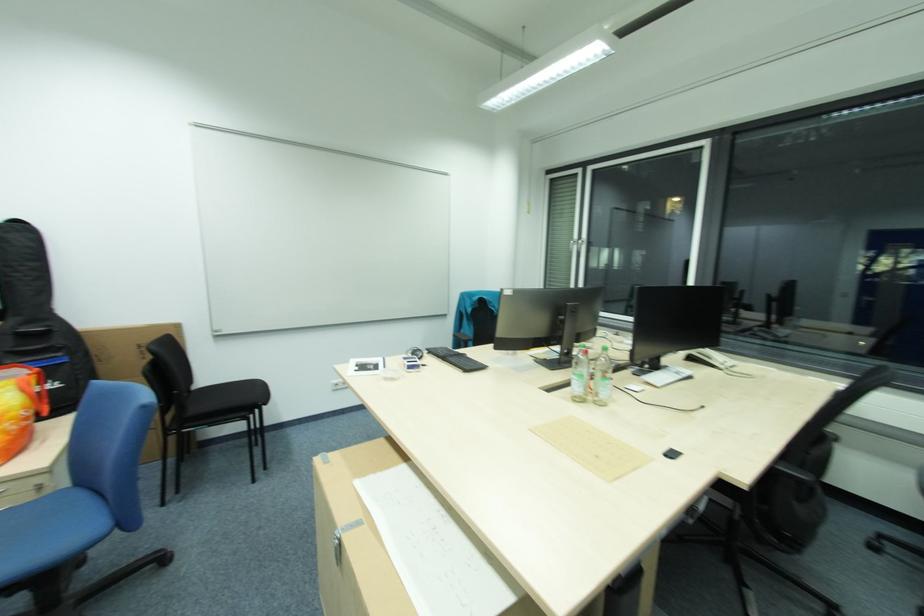
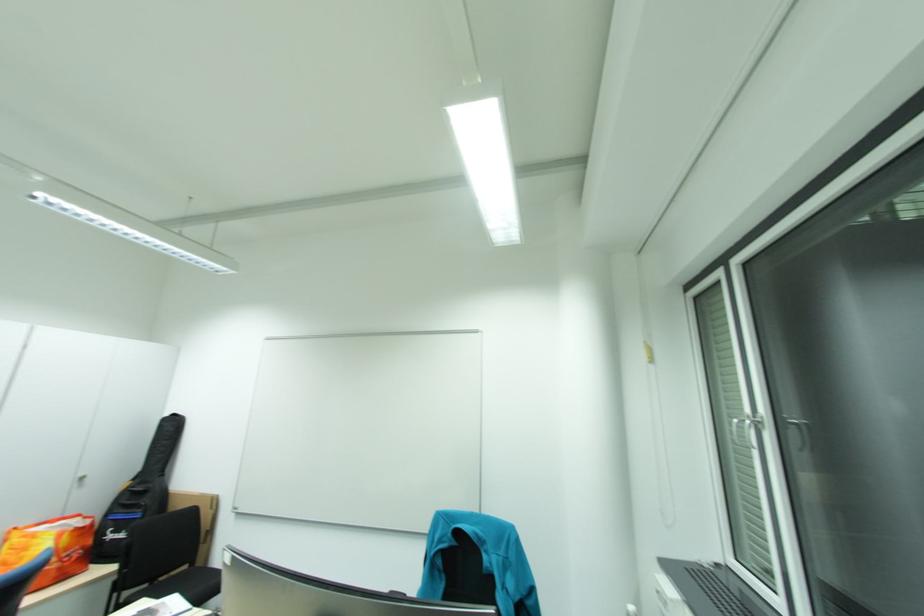
Find the pixel in the second image that matches [67,352] in the first image.

(149, 508)